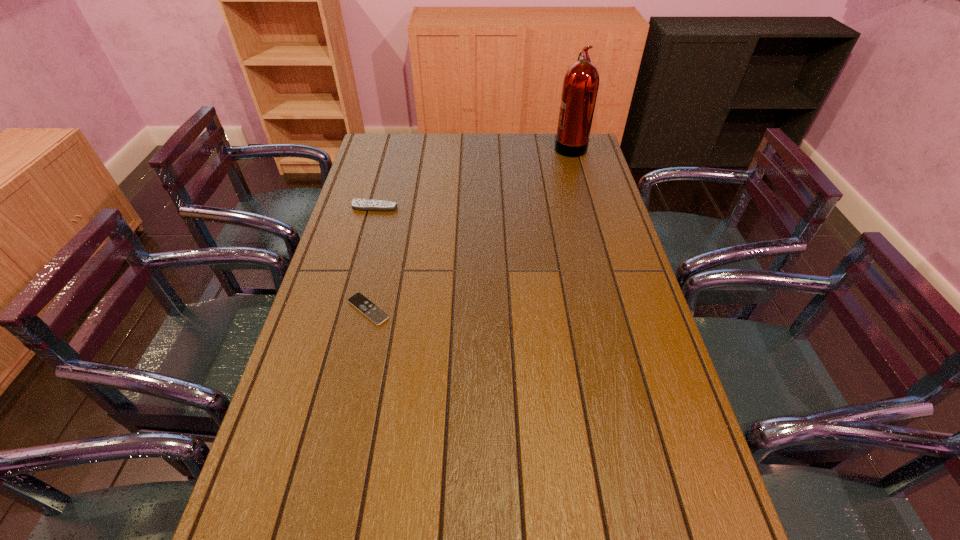
Identify the location of free space located 0.070m on the right of the shortest object. (416, 309).

The image size is (960, 540). Identify the location of object at the far edge. (580, 87).

Find the location of a particular element. The width and height of the screenshot is (960, 540). object at the right edge is located at coordinates (580, 87).

Locate an element on the screen. object that is at the far right corner is located at coordinates (580, 87).

The height and width of the screenshot is (540, 960). I want to click on vacant space at the far edge, so click(530, 140).

The width and height of the screenshot is (960, 540). Find the location of `vacant space at the left edge of the desktop`. vacant space at the left edge of the desktop is located at coordinates (357, 368).

The height and width of the screenshot is (540, 960). What are the coordinates of `free space at the right edge` in the screenshot? It's located at (577, 234).

I want to click on vacant space at the far left corner, so click(x=380, y=139).

Where is `free space between the shorter remote control and the tallest object`? Image resolution: width=960 pixels, height=540 pixels. free space between the shorter remote control and the tallest object is located at coordinates (469, 227).

This screenshot has height=540, width=960. Identify the location of unoccupied area between the farther remote control and the shortest object. (372, 258).